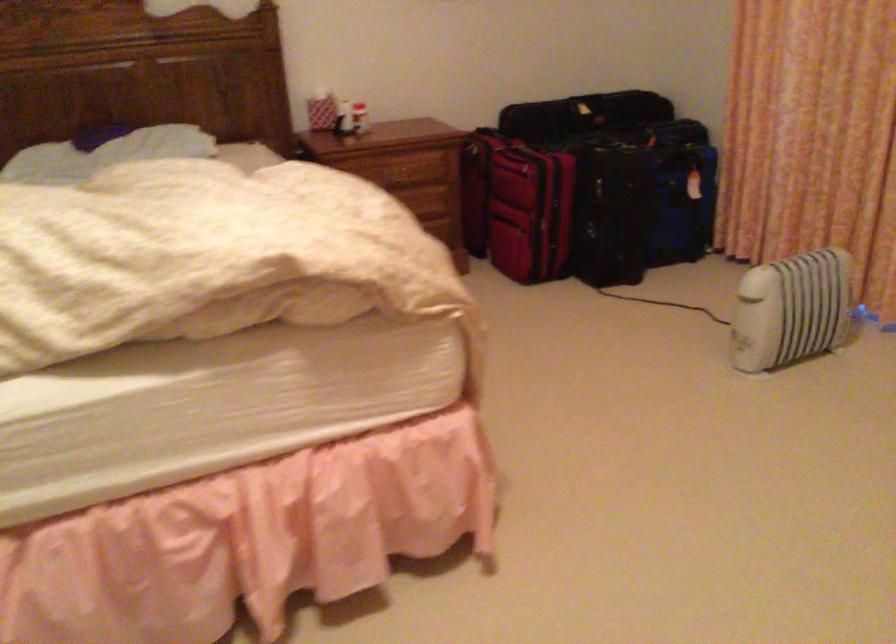
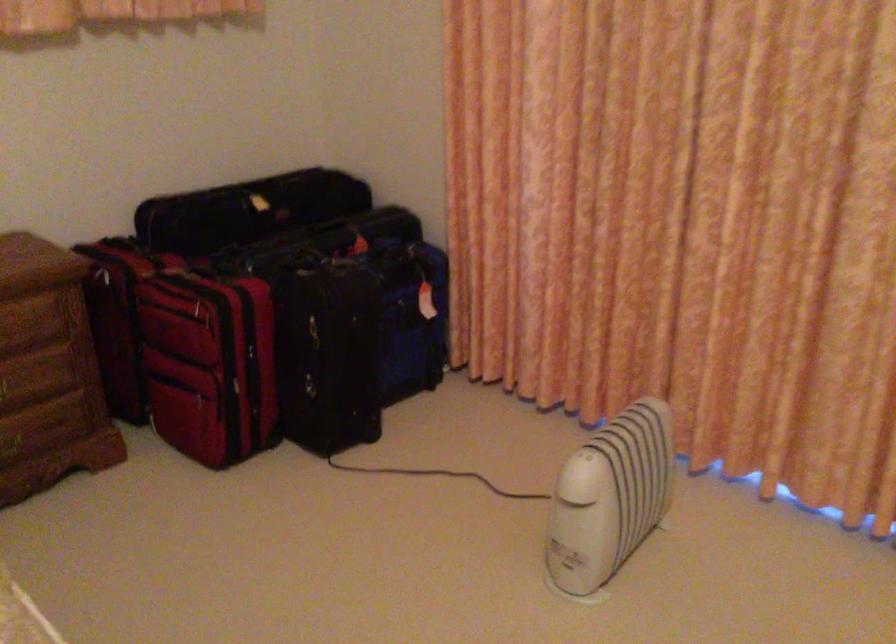
The point at (x=409, y=162) is marked in the first image. Where is the corresponding point in the second image?

(14, 319)